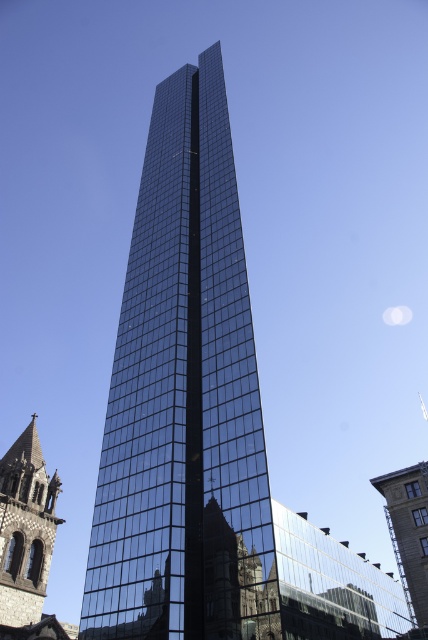
Is glossy glass tower at center above dark brown stone church steeple at lower left?

Indeed, glossy glass tower at center is positioned over dark brown stone church steeple at lower left.

Can you confirm if glossy glass tower at center is thinner than dark brown stone church steeple at lower left?

No, glossy glass tower at center is not thinner than dark brown stone church steeple at lower left.

Is point (255, 426) in front of point (47, 545)?

Yes, it is.

This screenshot has height=640, width=428. Identify the location of glossy glass tower at center. pos(184,401).

Which of these two, glossy glass tower at center or glassy reflective building at center, stands taller?

glossy glass tower at center

In order to click on glossy glass tower at center in this screenshot , I will do (184, 401).

Is point (214, 497) in front of point (401, 547)?

That is True.

This screenshot has height=640, width=428. Find the location of `glossy glass tower at center`. glossy glass tower at center is located at coordinates (184, 401).

How much distance is there between dark brown stone church steeple at lower left and glassy reflective building at center?

The distance of dark brown stone church steeple at lower left from glassy reflective building at center is 40.56 meters.

Can you confirm if dark brown stone church steeple at lower left is smaller than glassy reflective building at center?

Actually, dark brown stone church steeple at lower left might be larger than glassy reflective building at center.

Is point (38, 536) behind point (409, 554)?

That is True.

Find the location of a particular element. dark brown stone church steeple at lower left is located at coordinates (26, 529).